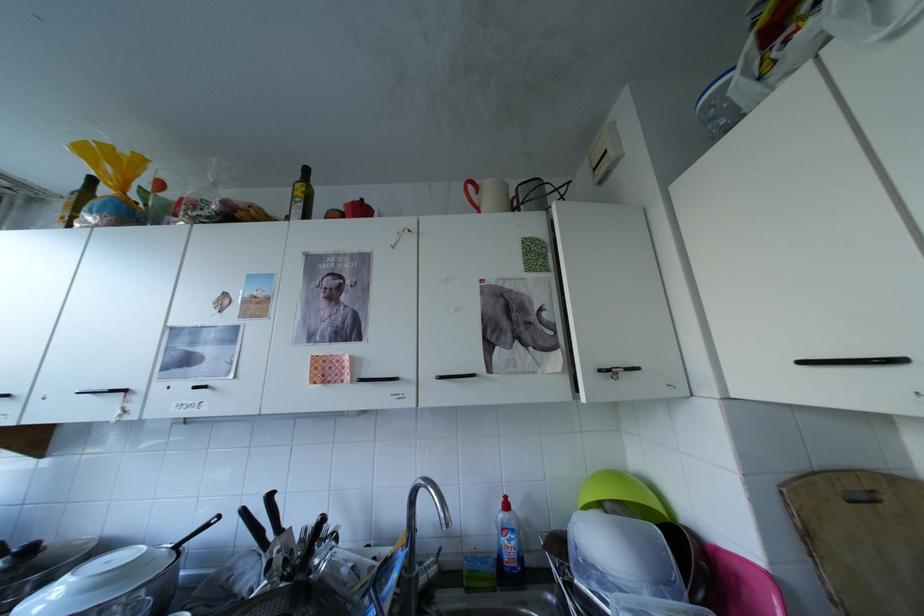
Find where to grasp the long pan handle. Please return your answer as a coordinate pair (x, y).

(116, 583)